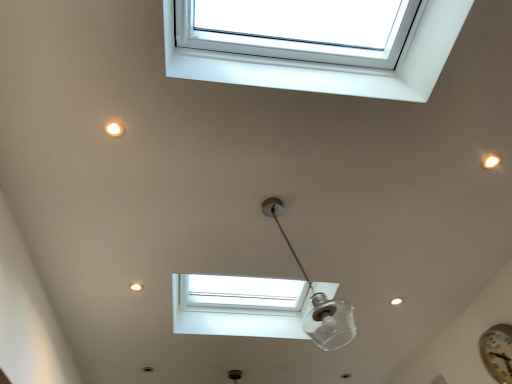
Question: From a real-world perspective, is transparent glass lamp at center positioned under white plastic window at upper center based on gravity?

Choices:
 (A) no
 (B) yes

Answer: (B)

Question: Can you confirm if transparent glass lamp at center is shorter than white plastic window at upper center?

Choices:
 (A) no
 (B) yes

Answer: (A)

Question: Are transparent glass lamp at center and white plastic window at upper center located far from each other?

Choices:
 (A) yes
 (B) no

Answer: (A)

Question: Is transparent glass lamp at center further to camera compared to white plastic window at upper center?

Choices:
 (A) no
 (B) yes

Answer: (B)

Question: Is transparent glass lamp at center thinner than white plastic window at upper center?

Choices:
 (A) no
 (B) yes

Answer: (B)

Question: Do you think white plastic window at upper center is within metallic silver clock at lower right, or outside of it?

Choices:
 (A) outside
 (B) inside

Answer: (A)

Question: From a real-world perspective, is white plastic window at upper center above or below metallic silver clock at lower right?

Choices:
 (A) above
 (B) below

Answer: (A)

Question: Looking at the image, does white plastic window at upper center seem bigger or smaller compared to metallic silver clock at lower right?

Choices:
 (A) big
 (B) small

Answer: (A)

Question: From the image's perspective, is white plastic window at upper center positioned above or below metallic silver clock at lower right?

Choices:
 (A) below
 (B) above

Answer: (B)

Question: Looking at the image, does white plastic window at upper center seem bigger or smaller compared to transparent glass lamp at center?

Choices:
 (A) small
 (B) big

Answer: (B)

Question: In the image, is white plastic window at upper center positioned in front of or behind transparent glass lamp at center?

Choices:
 (A) behind
 (B) front

Answer: (B)

Question: Is point (392, 81) closer or farther from the camera than point (289, 244)?

Choices:
 (A) closer
 (B) farther

Answer: (A)

Question: Considering the positions of white plastic window at upper center and transparent glass lamp at center in the image, is white plastic window at upper center taller or shorter than transparent glass lamp at center?

Choices:
 (A) short
 (B) tall

Answer: (A)

Question: Is transparent glass lamp at center bigger or smaller than metallic silver clock at lower right?

Choices:
 (A) big
 (B) small

Answer: (A)

Question: In terms of height, does transparent glass lamp at center look taller or shorter compared to metallic silver clock at lower right?

Choices:
 (A) short
 (B) tall

Answer: (B)